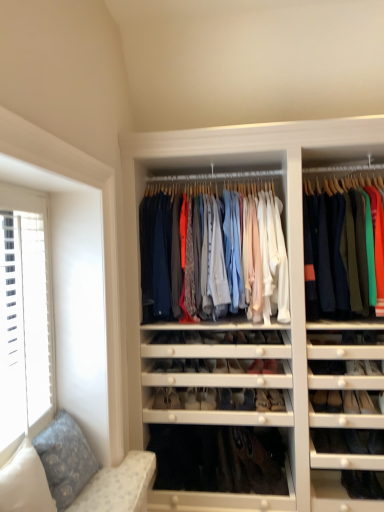
Question: Which direction should I rotate to face matte black shoe at center, the 1th shoe when ordered from left to right, — up or down?

Choices:
 (A) up
 (B) down

Answer: (B)

Question: Is the surface of matte black shoe at center, positioned as the second shoe in right-to-left order, in direct contact with solid navy blue pants at right, positioned as the 2th clothing in left-to-right order?

Choices:
 (A) no
 (B) yes

Answer: (A)

Question: Is matte black shoe at center, positioned as the second shoe in right-to-left order, aimed at solid navy blue pants at right, positioned as the 2th clothing in left-to-right order?

Choices:
 (A) yes
 (B) no

Answer: (B)

Question: Can you confirm if matte black shoe at center, positioned as the second shoe in right-to-left order, is smaller than solid navy blue pants at right, positioned as the 2th clothing in left-to-right order?

Choices:
 (A) no
 (B) yes

Answer: (B)

Question: Does matte black shoe at center, the 6th shoe viewed from the left, have a lesser width compared to solid navy blue pants at right, which is the 1th clothing from right to left?

Choices:
 (A) yes
 (B) no

Answer: (A)

Question: Considering the relative positions of matte black shoe at center, positioned as the second shoe in right-to-left order, and solid navy blue pants at right, which is the 1th clothing from right to left, in the image provided, is matte black shoe at center, positioned as the second shoe in right-to-left order, to the left of solid navy blue pants at right, which is the 1th clothing from right to left, from the viewer's perspective?

Choices:
 (A) yes
 (B) no

Answer: (A)

Question: Considering the relative positions of matte black shoe at center, positioned as the second shoe in right-to-left order, and solid navy blue pants at right, positioned as the 2th clothing in left-to-right order, in the image provided, is matte black shoe at center, positioned as the second shoe in right-to-left order, in front of solid navy blue pants at right, positioned as the 2th clothing in left-to-right order,?

Choices:
 (A) yes
 (B) no

Answer: (B)

Question: Does matte white shoe at center, the 5th shoe positioned from the right, appear on the right side of matte black shoe at center, positioned as the second shoe in right-to-left order?

Choices:
 (A) no
 (B) yes

Answer: (A)

Question: From the image's perspective, does matte white shoe at center, which is counted as the 3th shoe, starting from the left, appear lower than matte black shoe at center, the 6th shoe viewed from the left?

Choices:
 (A) yes
 (B) no

Answer: (A)

Question: Does matte white shoe at center, the 5th shoe positioned from the right, appear on the left side of matte black shoe at center, the 6th shoe viewed from the left?

Choices:
 (A) yes
 (B) no

Answer: (A)

Question: From a real-world perspective, is matte white shoe at center, which is counted as the 3th shoe, starting from the left, positioned over matte black shoe at center, positioned as the second shoe in right-to-left order, based on gravity?

Choices:
 (A) no
 (B) yes

Answer: (A)

Question: Is matte white shoe at center, the 5th shoe positioned from the right, oriented away from matte black shoe at center, the 6th shoe viewed from the left?

Choices:
 (A) yes
 (B) no

Answer: (B)

Question: Is matte white shoe at center, which is counted as the 3th shoe, starting from the left, in contact with matte black shoe at center, positioned as the second shoe in right-to-left order?

Choices:
 (A) no
 (B) yes

Answer: (A)

Question: Is matte black shoe at center, the 1th shoe when ordered from left to right, not within matte black shoe at center, the 1th shoe viewed from the right?

Choices:
 (A) yes
 (B) no

Answer: (A)